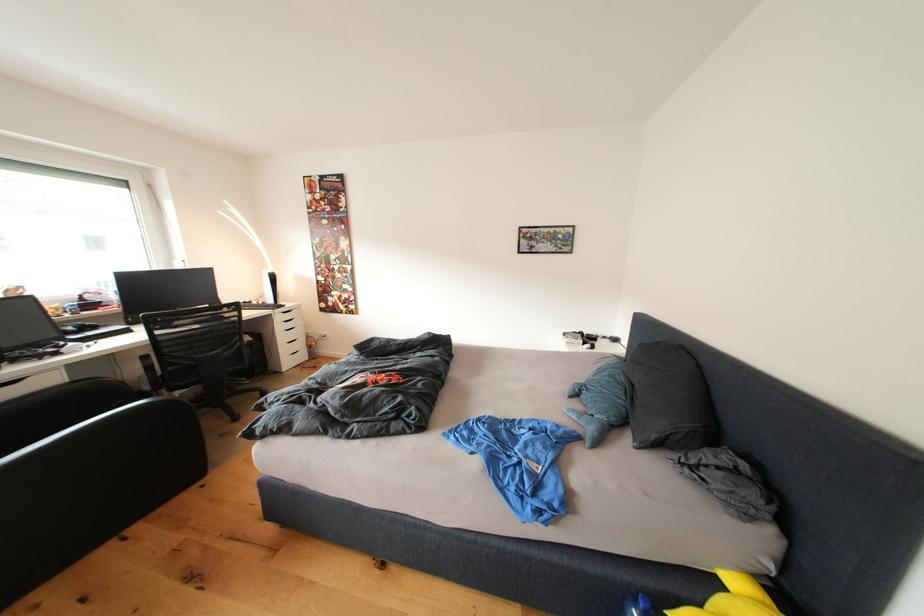
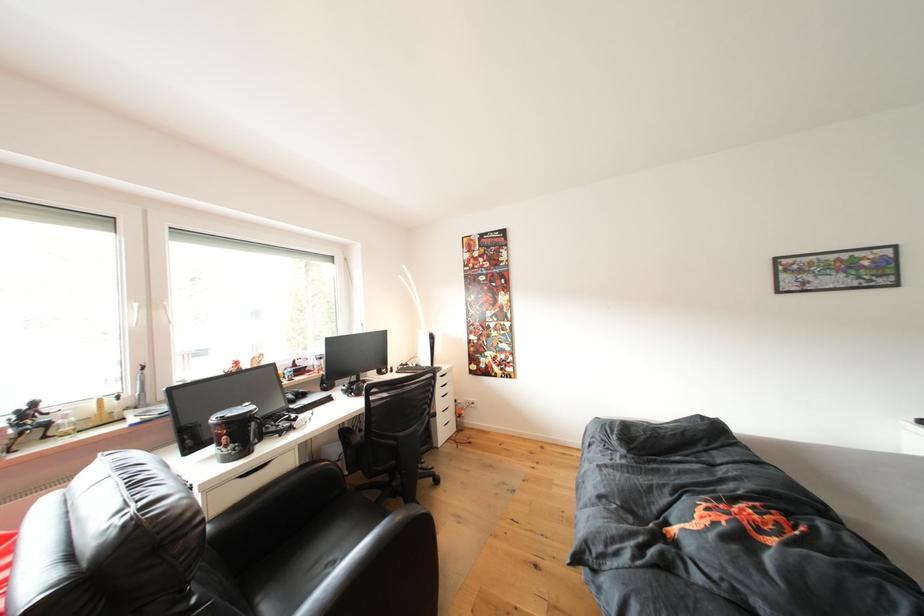
Locate, in the second image, the point that corresponds to the point at 290,308 in the first image.

(444, 370)